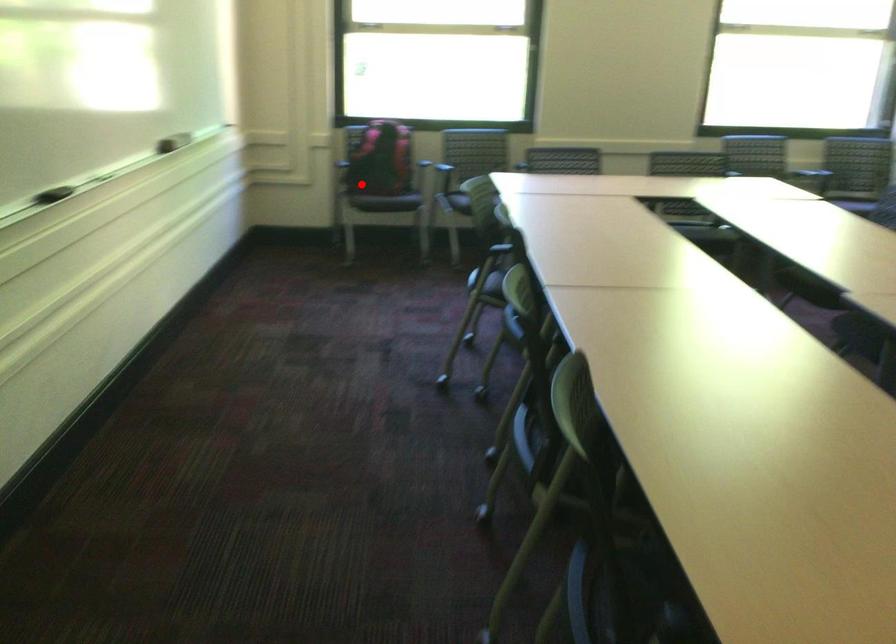
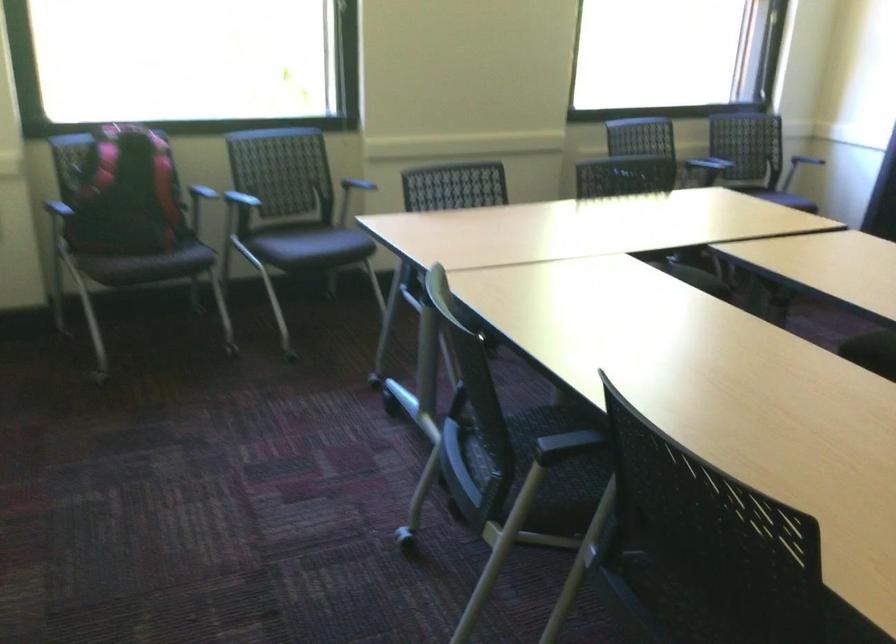
Find the pixel in the second image that matches the highlighted location in the first image.

(124, 261)